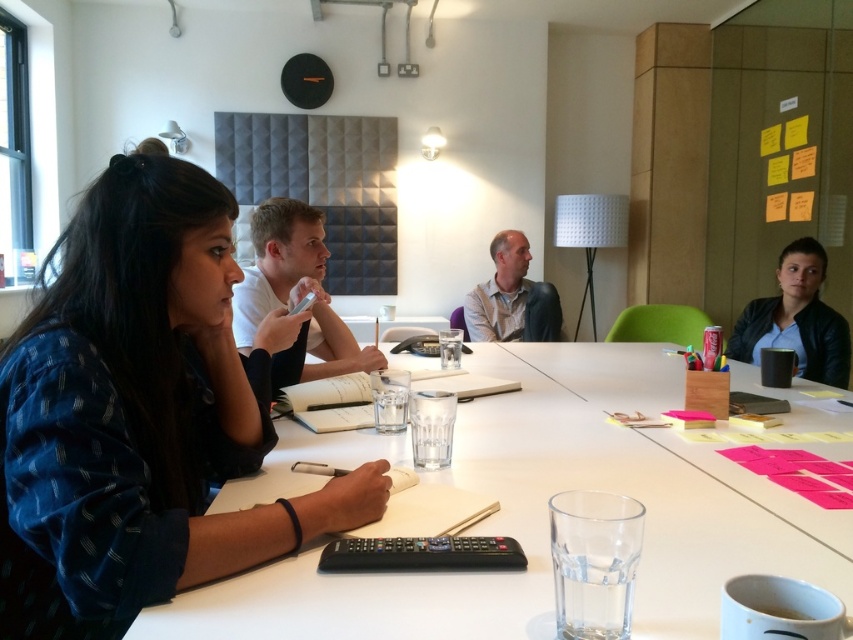
Question: Considering the relative positions of white paper at center and matte black jacket at upper right in the image provided, where is white paper at center located with respect to matte black jacket at upper right?

Choices:
 (A) below
 (B) above

Answer: (A)

Question: Among these objects, which one is farthest from the camera?

Choices:
 (A) blue printed shirt at left
 (B) matte black jacket at upper right
 (C) light beige shirt at center
 (D) white plastic table at center

Answer: (C)

Question: Which object is positioned closest to the light beige shirt at center?

Choices:
 (A) white paper at center
 (B) white plastic table at center

Answer: (B)

Question: Which object is the farthest from the white paper at center?

Choices:
 (A) blue printed shirt at left
 (B) matte black jacket at upper right
 (C) white plastic table at center
 (D) light beige shirt at center

Answer: (B)

Question: Is white plastic table at center wider than matte black jacket at upper right?

Choices:
 (A) yes
 (B) no

Answer: (A)

Question: Can you confirm if blue printed shirt at left is positioned below white paper at center?

Choices:
 (A) yes
 (B) no

Answer: (A)